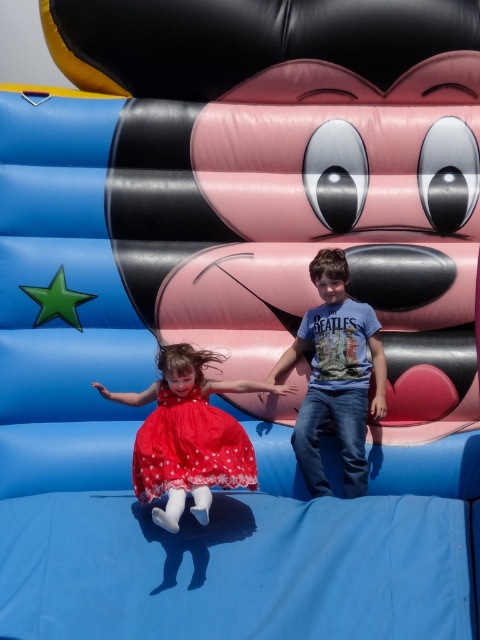
Question: Among these objects, which one is farthest from the camera?

Choices:
 (A) blue t-shirt at center
 (B) red satin dress at lower left

Answer: (A)

Question: Which object is the closest to the red satin dress at lower left?

Choices:
 (A) red polka dot dress at lower left
 (B) blue t-shirt at center

Answer: (A)

Question: Among these objects, which one is nearest to the camera?

Choices:
 (A) red polka dot dress at lower left
 (B) red satin dress at lower left

Answer: (A)

Question: Does blue t-shirt at center have a greater width compared to red satin dress at lower left?

Choices:
 (A) yes
 (B) no

Answer: (A)

Question: Can you confirm if red polka dot dress at lower left is smaller than red satin dress at lower left?

Choices:
 (A) no
 (B) yes

Answer: (A)

Question: Is the position of red polka dot dress at lower left less distant than that of red satin dress at lower left?

Choices:
 (A) no
 (B) yes

Answer: (B)